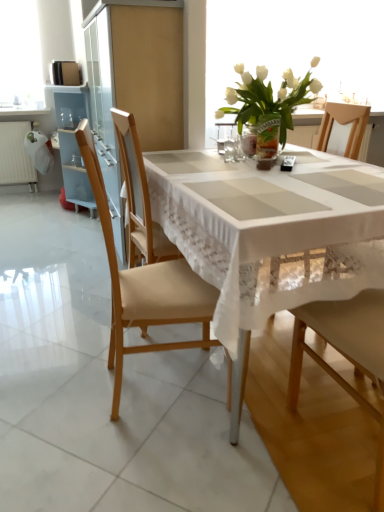
The width and height of the screenshot is (384, 512). I want to click on vacant space in front of white painted radiator at left, so click(19, 199).